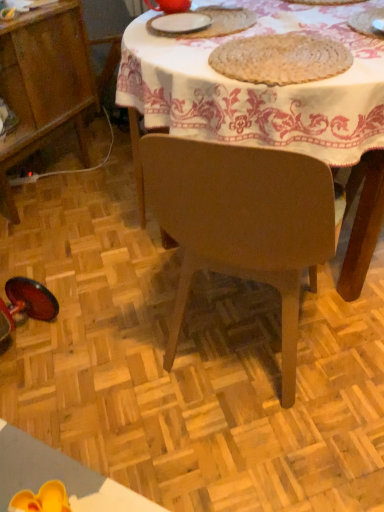
In order to click on free spot to the left of white matte plate at upper center, the 2th tableware in the left-to-right sequence in this screenshot , I will do `click(139, 31)`.